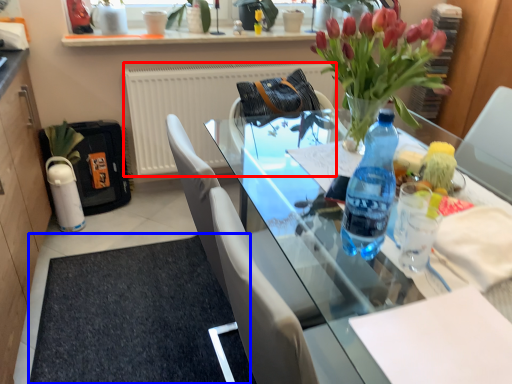
Question: Which point is further to the camera, radiator (highlighted by a red box) or doormat (highlighted by a blue box)?

Choices:
 (A) radiator
 (B) doormat

Answer: (A)